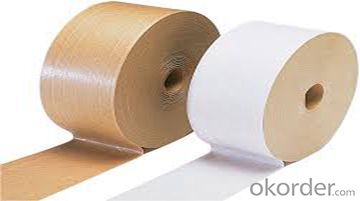
At what (x,y) coordinates should I click in order to perform the action: click on stationary supplies. Please return your answer as a coordinate pair (x, y). Looking at the image, I should click on (127, 102), (251, 115).